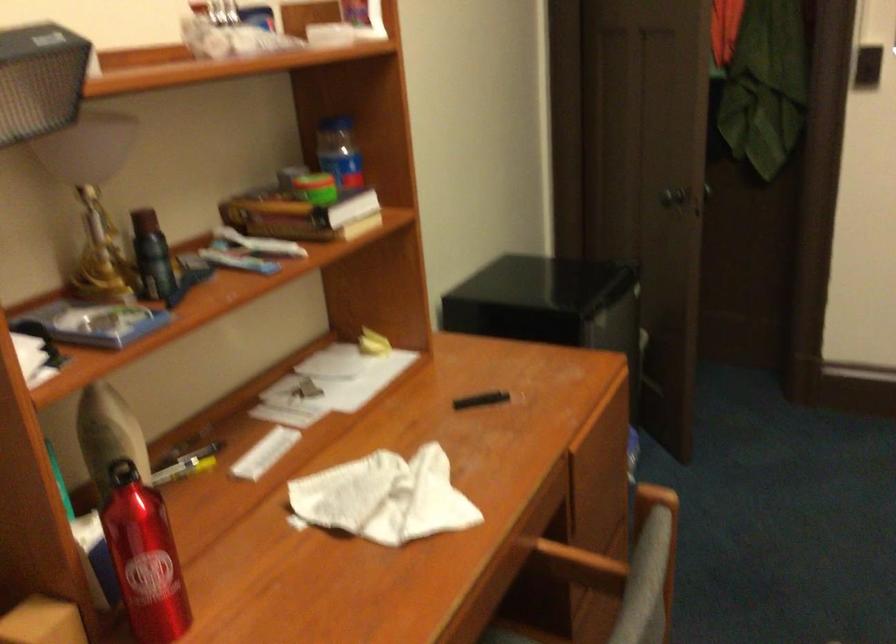
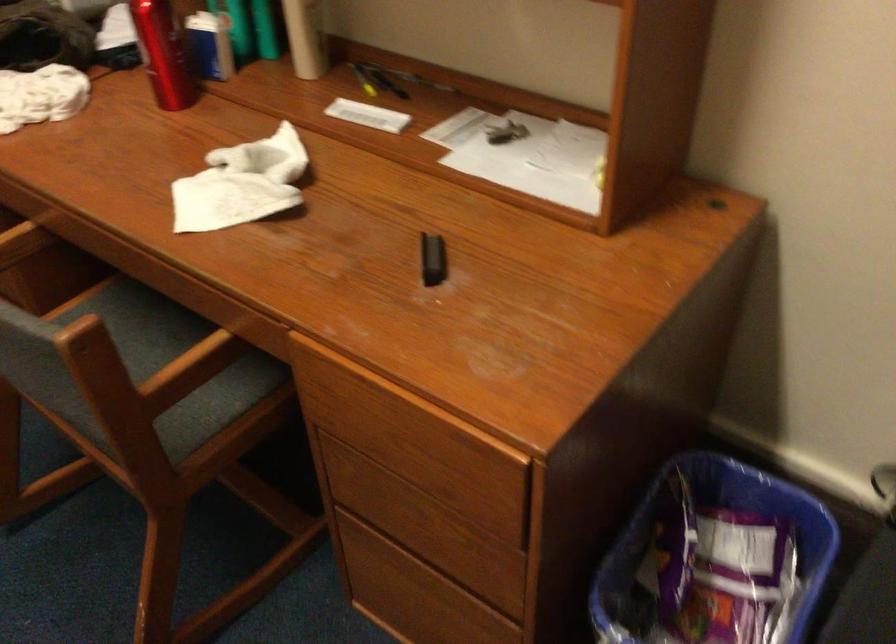
In the second image, find the point that corresponds to pixel 168 554 in the first image.

(162, 53)